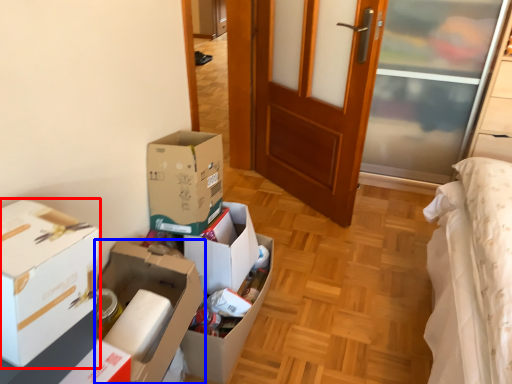
Question: Which of the following is the farthest to the observer, box (highlighted by a red box) or box (highlighted by a blue box)?

Choices:
 (A) box
 (B) box

Answer: (B)